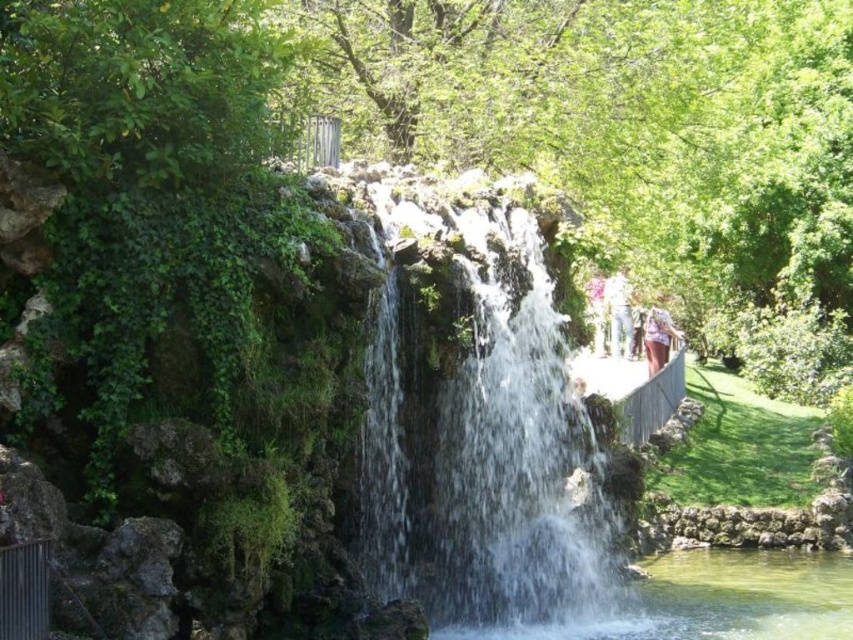
In the scene shown: You are standing at the edge of the waterfall and see both the clear water at center and the pink fabric at center. Which object is nearer to you?

The clear water at center is closer to the viewer than the pink fabric at center.

You are planning to place a small decorative statue in the scene. The statue requires a base that must be larger than the object it sits on. Given the clear water at center and the white fabric at right, which object should the statue be placed on?

The clear water at center has a larger size compared to the white fabric at right, so the statue should be placed on the white fabric at right because its base needs to be larger than the object it sits on.